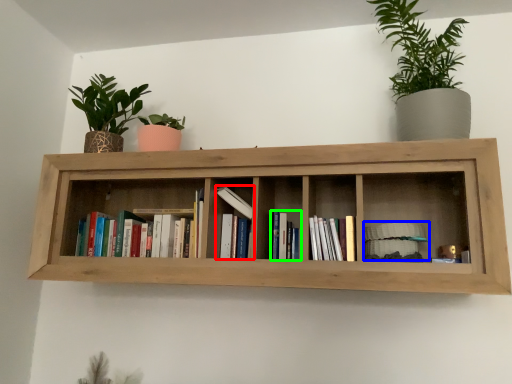
Question: Which is nearer to the book (highlighted by a red box)? book (highlighted by a blue box) or book (highlighted by a green box).

Choices:
 (A) book
 (B) book

Answer: (B)